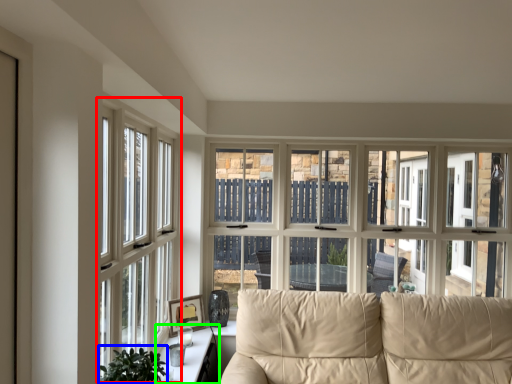
Question: Which object is positioned closest to window (highlighted by a red box)? Select from plant (highlighted by a blue box) and table (highlighted by a green box).

Choices:
 (A) plant
 (B) table

Answer: (B)